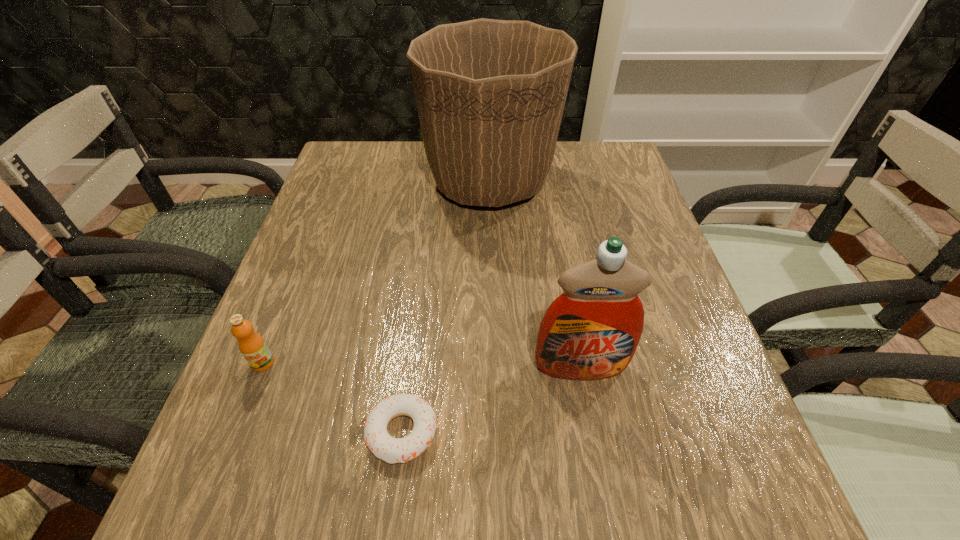
Identify the location of blank area located 0.240m on the right of the shortest object. The image size is (960, 540). (593, 432).

This screenshot has width=960, height=540. Find the location of `object that is at the far edge`. object that is at the far edge is located at coordinates (490, 93).

Where is `object present at the left edge`? The image size is (960, 540). object present at the left edge is located at coordinates (251, 344).

The width and height of the screenshot is (960, 540). I want to click on object that is positioned at the right edge, so click(x=591, y=331).

The height and width of the screenshot is (540, 960). In order to click on free space at the far edge in this screenshot , I will do tap(396, 156).

In order to click on free spot at the near edge of the desktop in this screenshot , I will do `click(500, 498)`.

In the image, there is a desktop. At what (x,y) coordinates should I click in order to perform the action: click on vacant area at the left edge. Please return your answer as a coordinate pair (x, y). Image resolution: width=960 pixels, height=540 pixels. Looking at the image, I should click on (299, 387).

In the image, there is a desktop. Identify the location of vacant space at the right edge. (643, 370).

The width and height of the screenshot is (960, 540). In the image, there is a desktop. In order to click on vacant space at the near left corner in this screenshot , I will do `click(224, 482)`.

At what (x,y) coordinates should I click in order to perform the action: click on vacant space at the far right corner. Please return your answer as a coordinate pair (x, y). The height and width of the screenshot is (540, 960). Looking at the image, I should click on (618, 186).